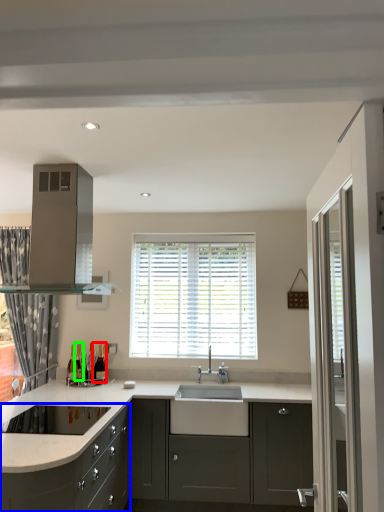
Question: Considering the real-world distances, which object is farthest from wine bottle (highlighted by a red box)? cabinetry (highlighted by a blue box) or wine bottle (highlighted by a green box)?

Choices:
 (A) cabinetry
 (B) wine bottle

Answer: (A)